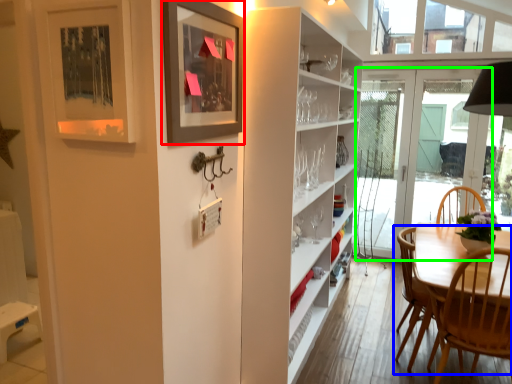
Question: Based on their relative distances, which object is nearer to picture frame (highlighted by a red box)? Choose from chair (highlighted by a blue box) and door (highlighted by a green box).

Choices:
 (A) chair
 (B) door

Answer: (A)